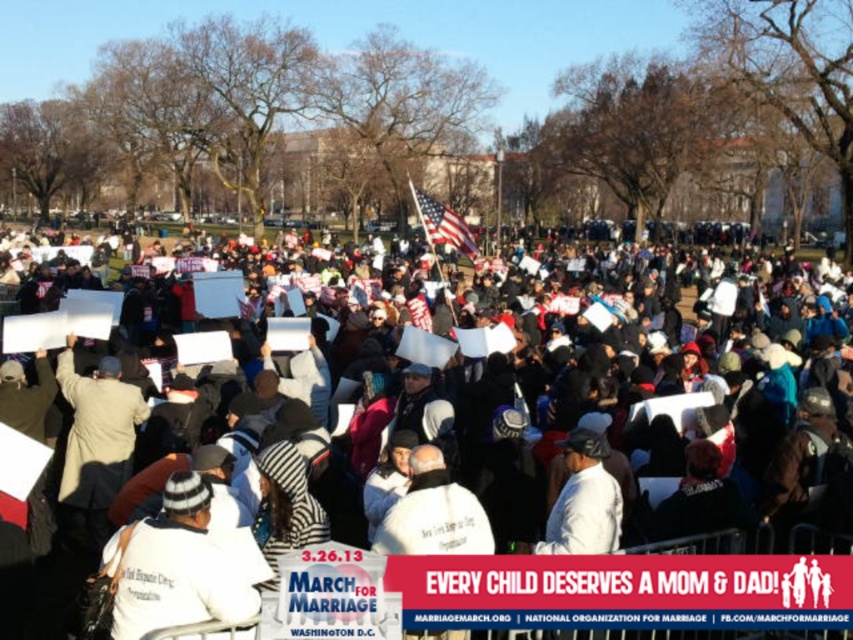
Based on the photo, you are a photographer trying to capture a clear shot of the white paper signs at center and the white matte jacket at center. Which object should you zoom in on to ensure it fills more of your camera frame?

The white paper signs at center is bigger than the white matte jacket at center, so you should zoom in on the white paper signs at center to ensure it fills more of your camera frame.

You are a photographer at the demonstration and want to capture a photo of the white paper signs at center and the white fleece jacket at lower left. Which object should you focus on first if you want to include both in your shot without moving the camera?

The white paper signs at center is taller than the white fleece jacket at lower left, so you should focus on the white paper signs at center first to ensure both are in frame.